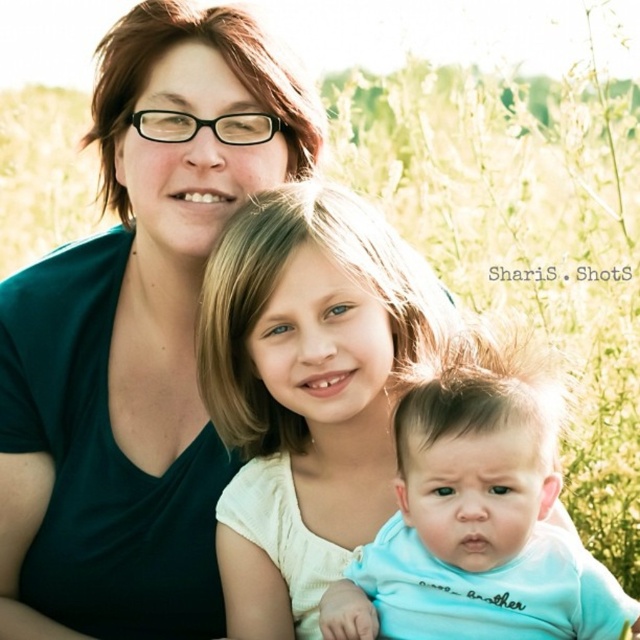
Measure the distance from smooth cream shirt at center to light blue fabric baby at center.

The distance of smooth cream shirt at center from light blue fabric baby at center is 9.69 inches.

Image resolution: width=640 pixels, height=640 pixels. Find the location of `smooth cream shirt at center`. smooth cream shirt at center is located at coordinates (308, 390).

Measure the distance between point (x=307, y=243) and camera.

Point (x=307, y=243) and camera are 5.44 feet apart.

Locate an element on the screen. smooth cream shirt at center is located at coordinates (308, 390).